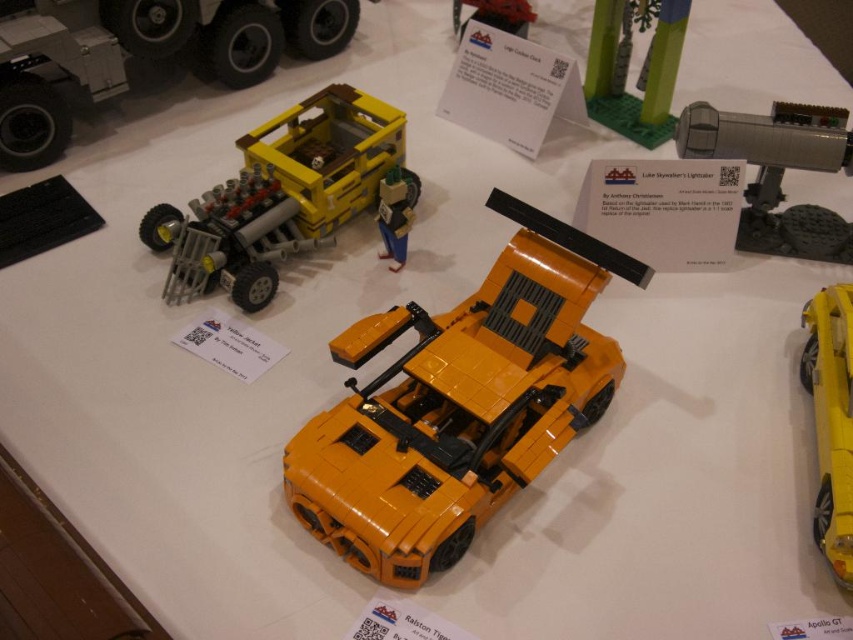
You are a LEGO designer working on a new display. You have a green matte tree at upper center and a matte black car at upper center. You need to place a new LEGO figure between them. How far apart should you position the figure from each object to maintain equal distance?

To maintain equal distance between the green matte tree at upper center and the matte black car at upper center, the LEGO figure should be placed 6.57 inches away from each object. Since the total distance between them is 13.14 inches, dividing that by two gives the midpoint distance of 6.57 inches.

You are a LEGO designer arranging these models for display. You need to ensure that the green matte tree at upper center and the matte black car at upper center are spaced apart so that their edges don not touch. Given their widths, which object requires more space between them to achieve this?

The green matte tree at upper center requires more space between them because its width surpasses that of the matte black car at upper center.

Looking at this image, you are a LEGO designer looking at the display. Which object at upper center is taller, the green matte tree at upper center or the matte black car at upper center?

The green matte tree at upper center has a greater height compared to the matte black car at upper center, so the green matte tree at upper center is taller.